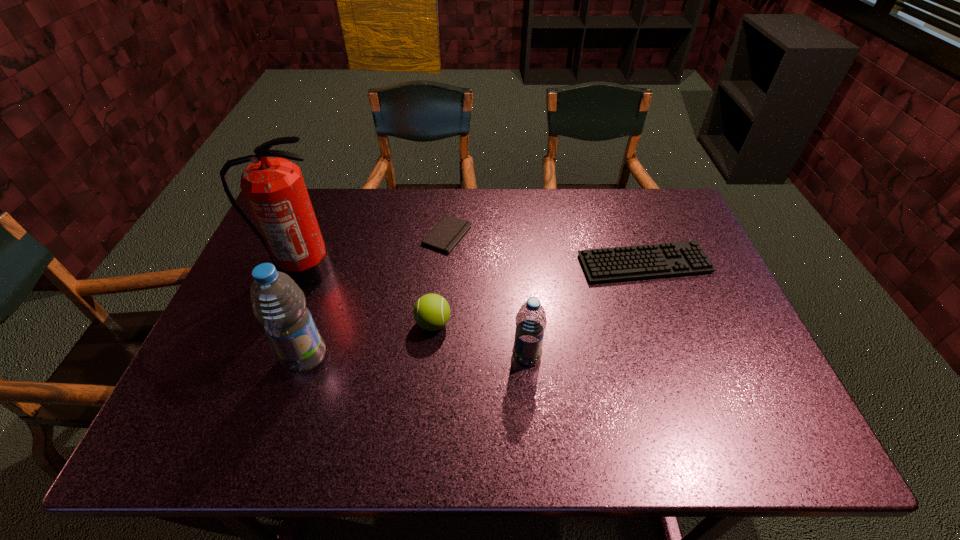
I want to click on free space located on the right of the fifth shortest object, so click(x=377, y=357).

Identify the location of blank space located on the back of the shorter water bottle. click(x=517, y=248).

At what (x,y) coordinates should I click in order to perform the action: click on free spot located 0.250m on the left of the checkbook. Please return your answer as a coordinate pair (x, y). Looking at the image, I should click on (343, 235).

Where is `vacant space located on the back of the third nearest object`? vacant space located on the back of the third nearest object is located at coordinates (440, 255).

Where is `free space located 0.080m on the left of the rightmost object`? free space located 0.080m on the left of the rightmost object is located at coordinates (552, 264).

Image resolution: width=960 pixels, height=540 pixels. Find the location of `vacant space located on the front side of the fire extinguisher`. vacant space located on the front side of the fire extinguisher is located at coordinates (275, 338).

What are the coordinates of `object that is at the far edge` in the screenshot? It's located at (449, 231).

The height and width of the screenshot is (540, 960). In order to click on object at the near edge in this screenshot , I will do `click(278, 303)`.

Locate an element on the screen. The height and width of the screenshot is (540, 960). object that is at the left edge is located at coordinates (274, 188).

I want to click on object that is at the right edge, so click(679, 258).